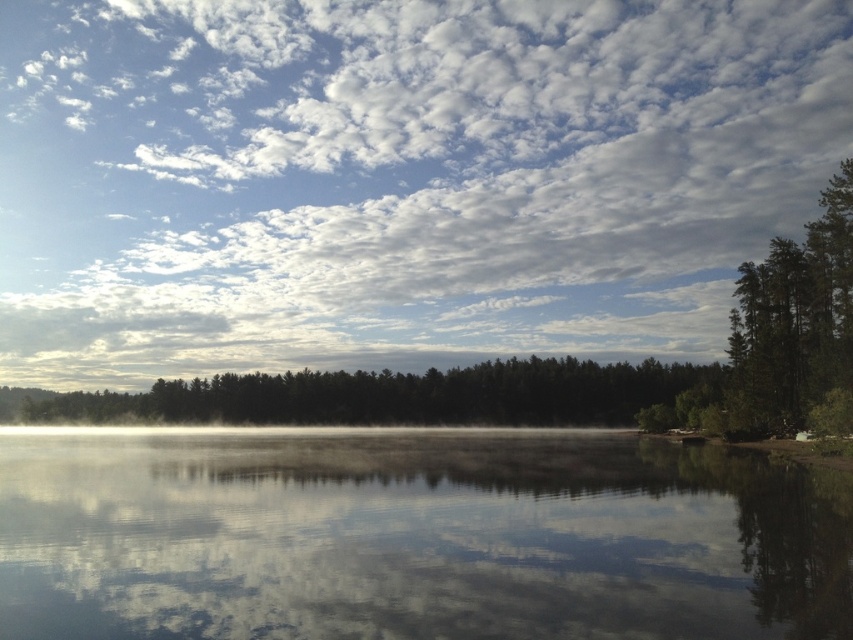
You are standing at the shoreline of the serene lake and see the green matte forest at center and the green textured tree at right. Which object is closer to the water?

The green matte forest at center is closer to the water because it is positioned under the green textured tree at right, indicating it is lower in the scene and nearer to the shoreline.

You are standing at the shoreline of the serene lake and see two points in the distance. The first point is located at coordinates point (598, 369) and the second point is at point (747, 410). Which point is closer to you?

Point (598, 369) is further to the camera than point (747, 410), so the point closer to you is point (747, 410).